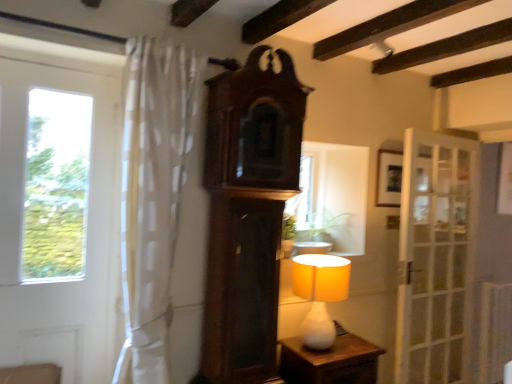
Identify the location of vacant area located to the right-hand side of white matte table lamp at center. The height and width of the screenshot is (384, 512). (355, 343).